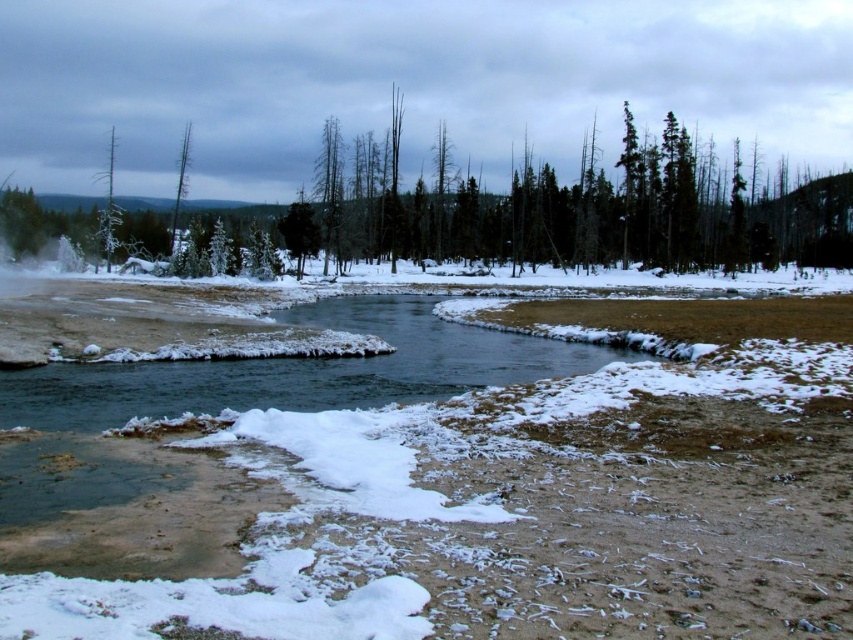
Question: Which of the following is the closest to the observer?

Choices:
 (A) green matte tree at upper center
 (B) frosty bark tree at upper left
 (C) dead wood tree at upper left

Answer: (A)

Question: Which object is closer to the camera taking this photo?

Choices:
 (A) dead wood tree at upper left
 (B) frosty bark tree at upper left

Answer: (B)

Question: Estimate the real-world distances between objects in this image. Which object is closer to the frosty bark tree at upper left?

Choices:
 (A) dead wood tree at upper left
 (B) green matte tree at upper center

Answer: (A)

Question: Is green matte tree at upper center smaller than frosty bark tree at upper left?

Choices:
 (A) yes
 (B) no

Answer: (B)

Question: Is green matte tree at upper center below frosty bark tree at upper left?

Choices:
 (A) yes
 (B) no

Answer: (B)

Question: Can you confirm if green matte tree at upper center is positioned to the right of frosty bark tree at upper left?

Choices:
 (A) no
 (B) yes

Answer: (B)